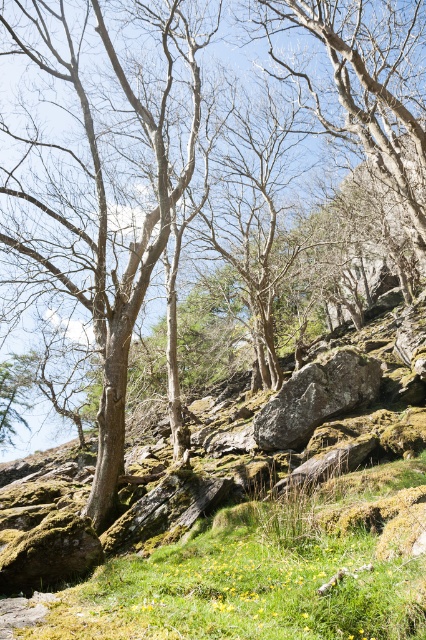
Question: Which object is closer to the camera taking this photo?

Choices:
 (A) green mossy rock at center
 (B) rocky mossy boulder at center

Answer: (B)

Question: Is rocky mossy boulder at center smaller than green mossy rock at center?

Choices:
 (A) no
 (B) yes

Answer: (A)

Question: Is rocky mossy boulder at center below green mossy rock at center?

Choices:
 (A) no
 (B) yes

Answer: (B)

Question: Is rocky mossy boulder at center further to camera compared to green mossy rock at center?

Choices:
 (A) yes
 (B) no

Answer: (B)

Question: Which point is farther from the camera taking this photo?

Choices:
 (A) (345, 406)
 (B) (305, 628)

Answer: (A)